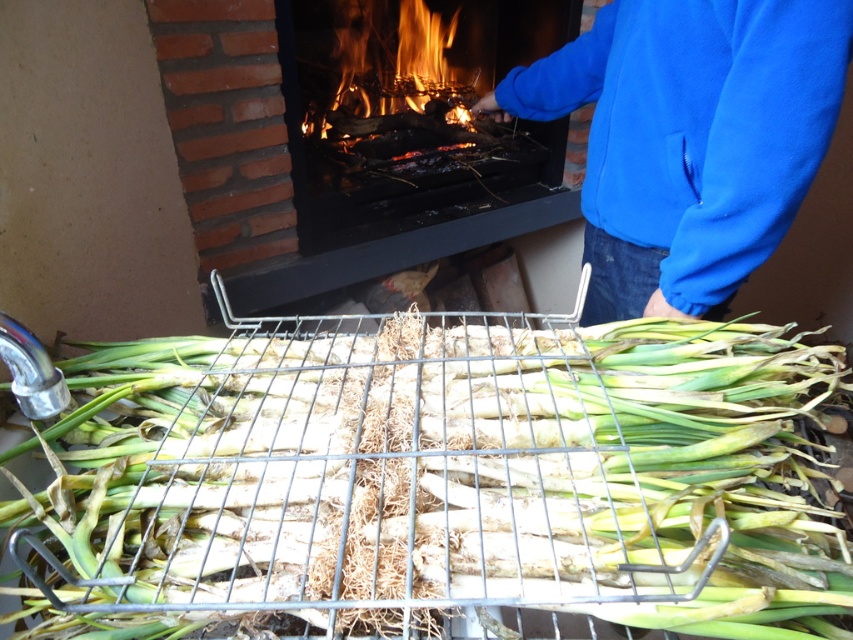
Question: Considering the real-world distances, which object is closest to the green fibrous vegetable at center?

Choices:
 (A) brick fireplace at upper center
 (B) blue fleece jacket at upper right

Answer: (B)

Question: Can you confirm if green fibrous vegetable at center is bigger than blue fleece jacket at upper right?

Choices:
 (A) yes
 (B) no

Answer: (A)

Question: Which object is closer to the camera taking this photo?

Choices:
 (A) brick fireplace at upper center
 (B) green fibrous vegetable at center

Answer: (B)

Question: Can you confirm if green fibrous vegetable at center is positioned above brick fireplace at upper center?

Choices:
 (A) yes
 (B) no

Answer: (B)

Question: Among these objects, which one is nearest to the camera?

Choices:
 (A) blue fleece jacket at upper right
 (B) green fibrous vegetable at center

Answer: (B)

Question: Considering the relative positions of blue fleece jacket at upper right and brick fireplace at upper center in the image provided, where is blue fleece jacket at upper right located with respect to brick fireplace at upper center?

Choices:
 (A) left
 (B) right

Answer: (B)